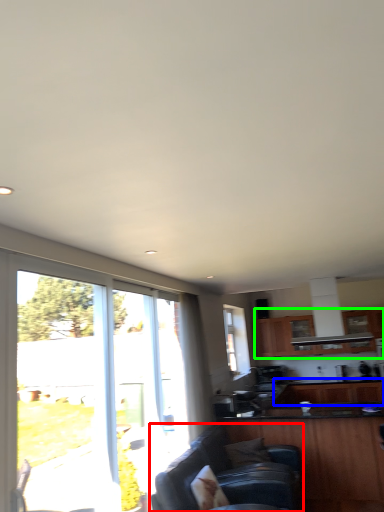
Question: Estimate the real-world distances between objects in this image. Which object is closer to studio couch (highlighted by a red box), cabinetry (highlighted by a blue box) or cabinetry (highlighted by a green box)?

Choices:
 (A) cabinetry
 (B) cabinetry

Answer: (A)